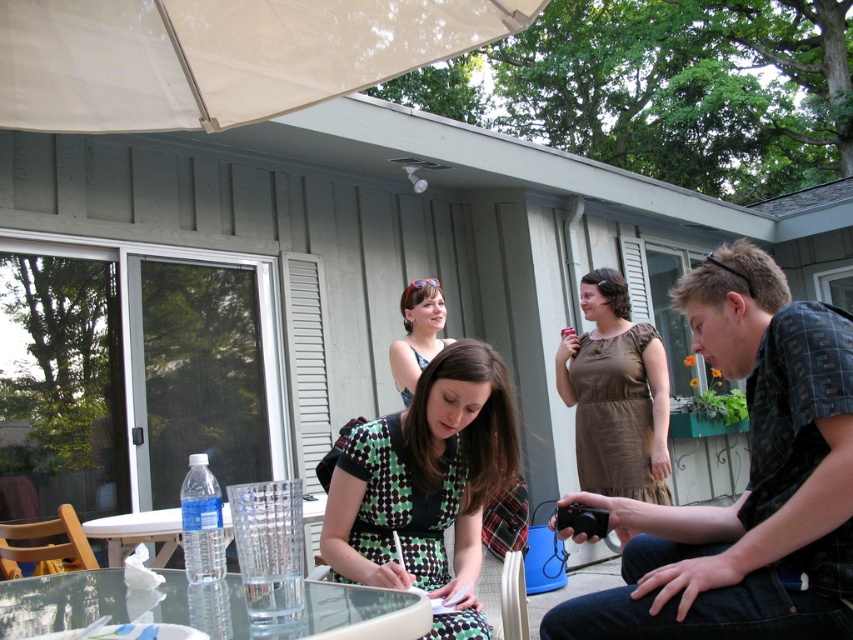
You are standing at the edge of the patio and want to place a 5.5 feet long decorative banner between the patterned fabric shirt at center and the clear glass table at center. Will the banner fit in the available space between them?

The distance between the patterned fabric shirt at center and the clear glass table at center is 5.65 feet. Since the banner is 5.5 feet long, it will fit with a small amount of space remaining.

You are standing at the edge of the patio looking towards the center. There is a brown satin dress at center and a clear glass table at center. Which object is positioned to the right of the other?

The brown satin dress at center is to the right of the clear glass table at center.